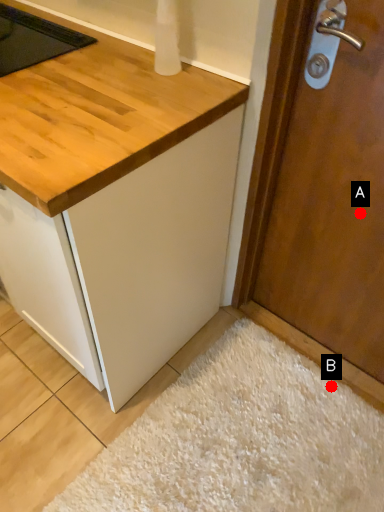
Question: Two points are circled on the image, labeled by A and B beside each circle. Which of the following is the farthest from the observer?

Choices:
 (A) A is further
 (B) B is further

Answer: (B)